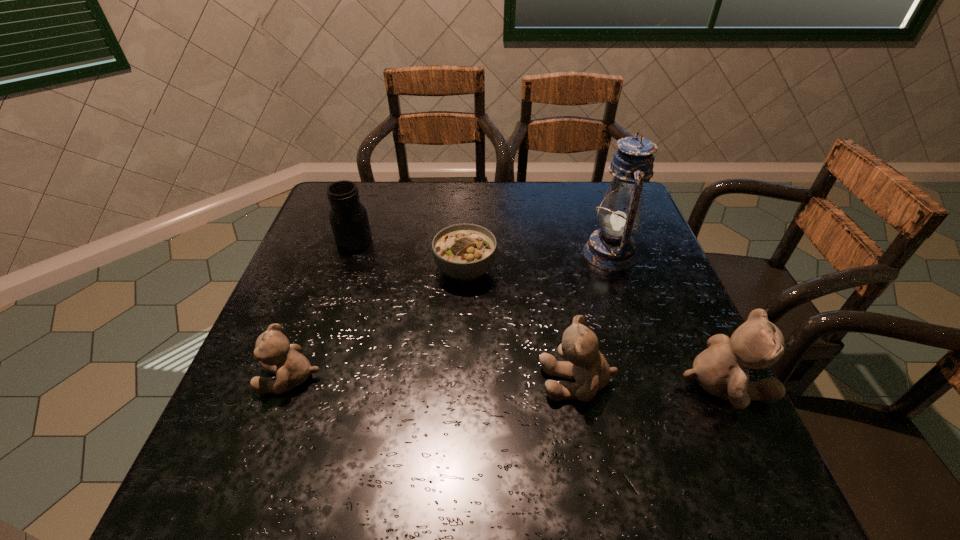
If equal spacing is desired by inserting an extra teddy_bear among them, please point out a free spot for this new teddy_bear. Please provide its 2D coordinates. Your answer should be formatted as a tuple, i.e. [(x, y)], where the tuple contains the x and y coordinates of a point satisfying the conditions above.

[(433, 380)]